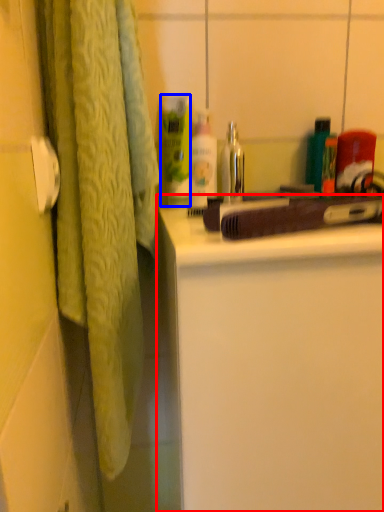
Question: Which of the following is the farthest to the observer, bathroom cabinet (highlighted by a red box) or cleaning product (highlighted by a blue box)?

Choices:
 (A) bathroom cabinet
 (B) cleaning product

Answer: (B)